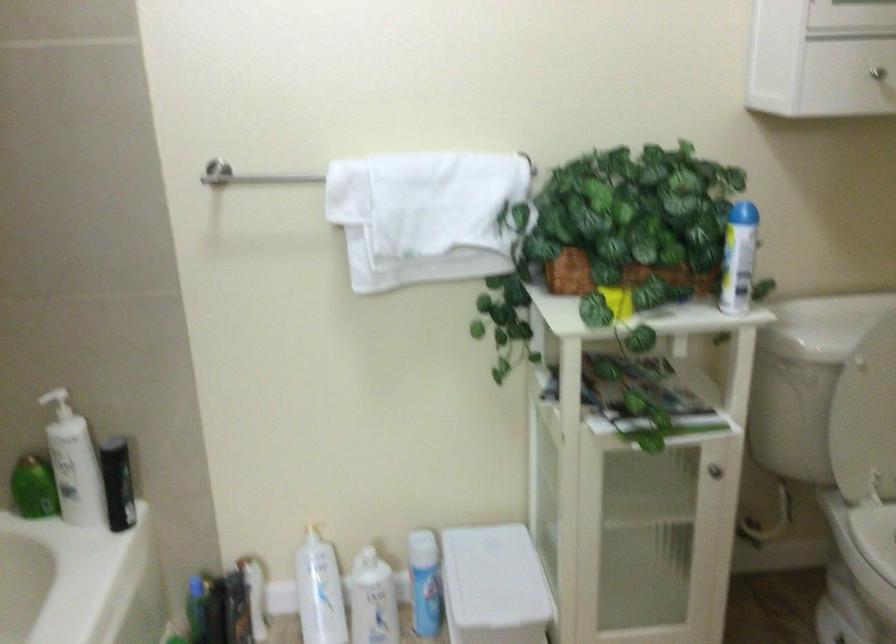
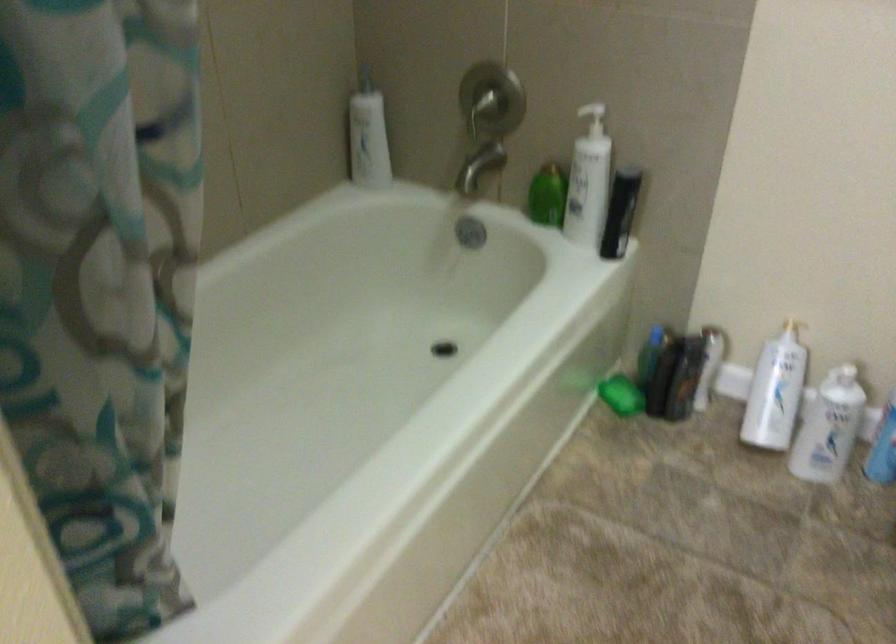
The first image is from the beginning of the video and the second image is from the end. How did the camera likely rotate when shooting the video?

The camera's rotation is toward left-down.